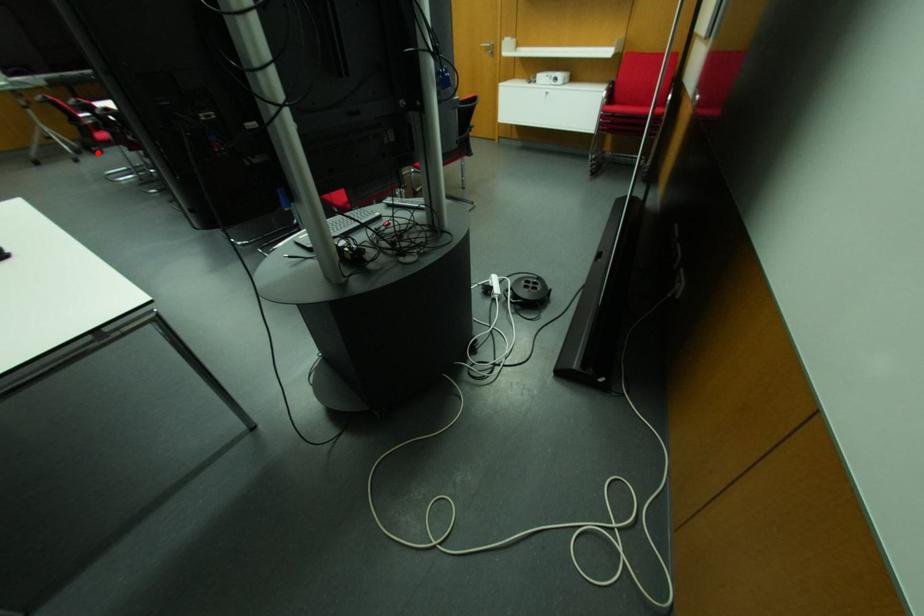
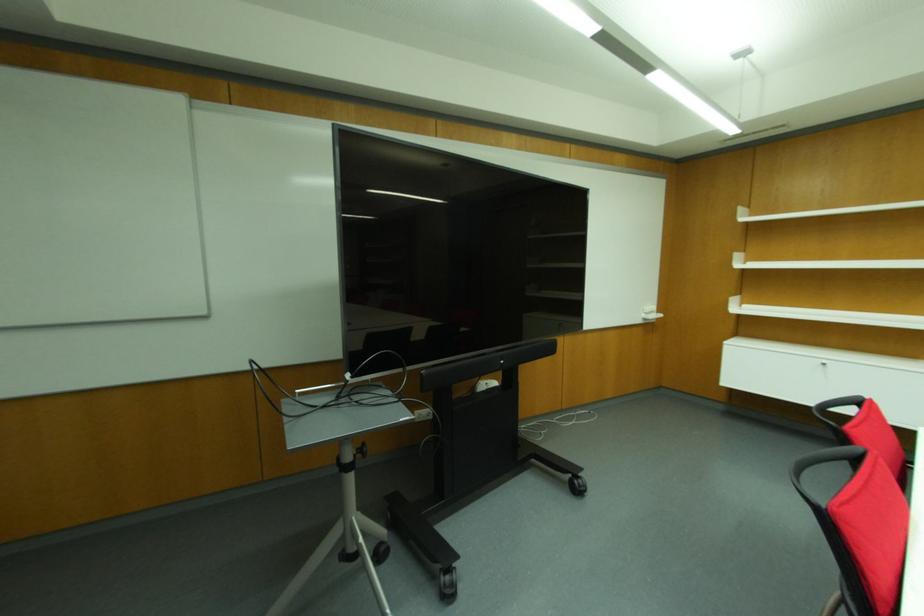
Question: I am providing you with two images of the same scene from different viewpoints. Given a red point in image1, look at the same physical point in image2. Is it:

Choices:
 (A) Closer to the viewpoint
 (B) Farther from the viewpoint

Answer: (A)